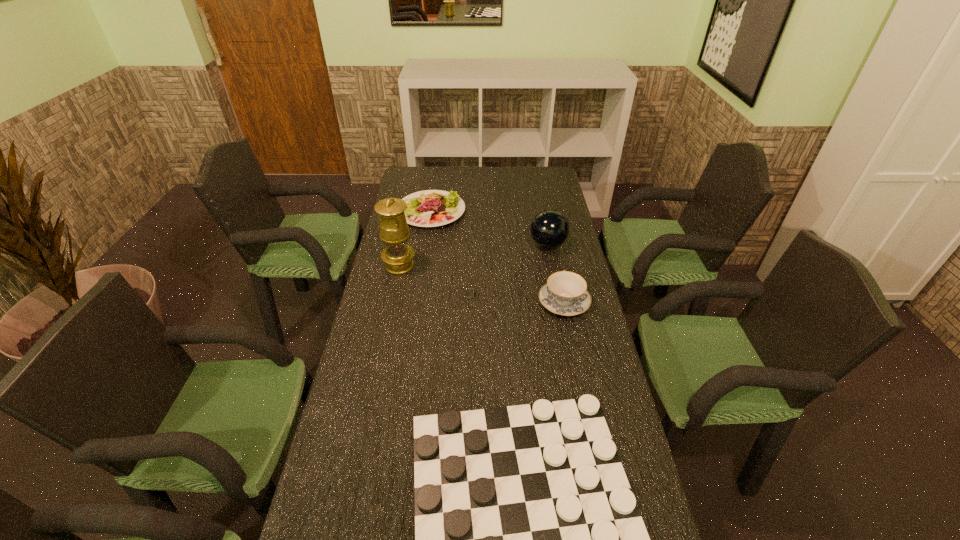
Image resolution: width=960 pixels, height=540 pixels. Find the location of `free space at the right edge`. free space at the right edge is located at coordinates (548, 312).

Find the location of `free spot at the far right corner of the desktop`. free spot at the far right corner of the desktop is located at coordinates pos(527,169).

Where is `free space between the chinaware and the farthest object`? free space between the chinaware and the farthest object is located at coordinates (497, 256).

Locate an element on the screen. vacant area that lies between the fifth shortest object and the farthest object is located at coordinates (490, 228).

Locate an element on the screen. This screenshot has width=960, height=540. vacant area between the fourth tallest object and the chinaware is located at coordinates (497, 256).

Image resolution: width=960 pixels, height=540 pixels. I want to click on vacant region between the third tallest object and the third shortest object, so click(x=497, y=256).

At what (x,y) coordinates should I click in order to perform the action: click on unoccupied position between the oil lamp and the bowling ball. Please return your answer as a coordinate pair (x, y). This screenshot has width=960, height=540. Looking at the image, I should click on (473, 255).

The image size is (960, 540). Identify the location of vacant area that lies between the oil lamp and the second tallest object. (473, 255).

This screenshot has width=960, height=540. Find the location of `free space between the bowling ball and the tallest object`. free space between the bowling ball and the tallest object is located at coordinates point(473,255).

You are a GUI agent. You are given a task and a screenshot of the screen. Output one action in this format:
    pyautogui.click(x=<x>, y=<y>)
    Task: Click on the object that is the third closest to the watch
    The image size is (960, 540).
    Given the screenshot: What is the action you would take?
    pyautogui.click(x=549, y=229)